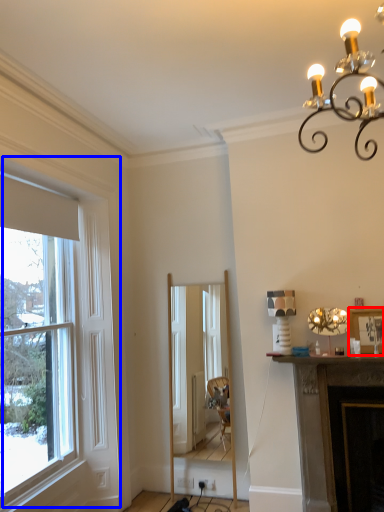
Question: Which object appears farthest to the camera in this image, picture frame (highlighted by a red box) or window (highlighted by a blue box)?

Choices:
 (A) picture frame
 (B) window

Answer: (A)